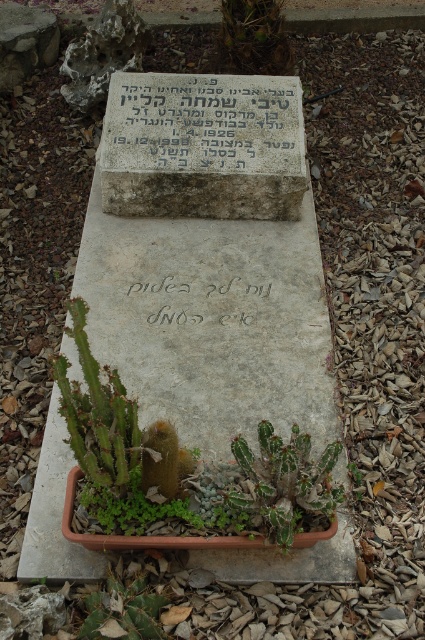
Question: Which point appears closest to the camera in this image?

Choices:
 (A) (163, 602)
 (B) (261, 28)

Answer: (A)

Question: Considering the relative positions of green spiky cactus at center and green spiky cactus at upper center in the image provided, where is green spiky cactus at center located with respect to green spiky cactus at upper center?

Choices:
 (A) below
 (B) above

Answer: (A)

Question: Which point appears farthest from the camera in this image?

Choices:
 (A) (87, 632)
 (B) (255, 483)

Answer: (B)

Question: Does stone inscription at center come behind white stone writing at center?

Choices:
 (A) no
 (B) yes

Answer: (B)

Question: From the image, what is the correct spatial relationship of green spiky cactus at center in relation to white stone writing at center?

Choices:
 (A) left
 (B) right

Answer: (B)

Question: Which is farther from the green spiky cactus at center?

Choices:
 (A) stone inscription at center
 (B) green spiky cactus at upper center
 (C) green spiky cactus at lower center

Answer: (B)